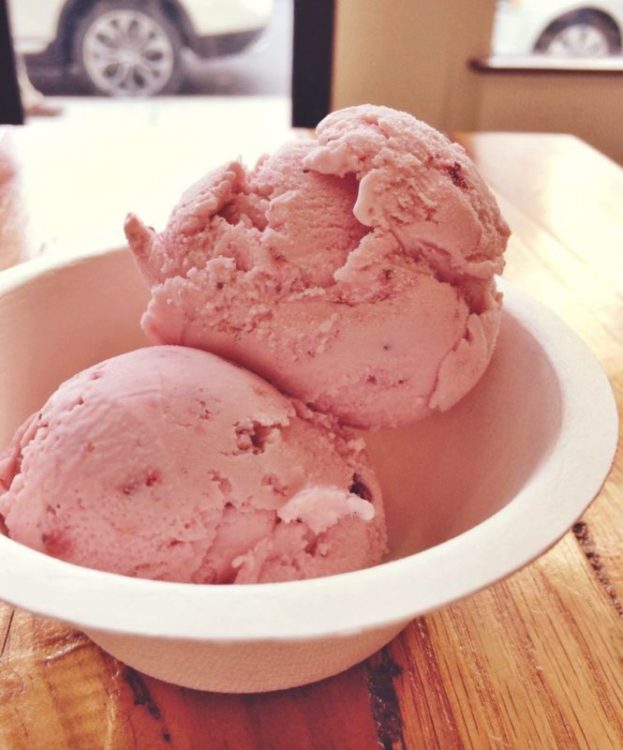
This screenshot has height=750, width=623. Find the location of `brown counter`. brown counter is located at coordinates (523, 64).